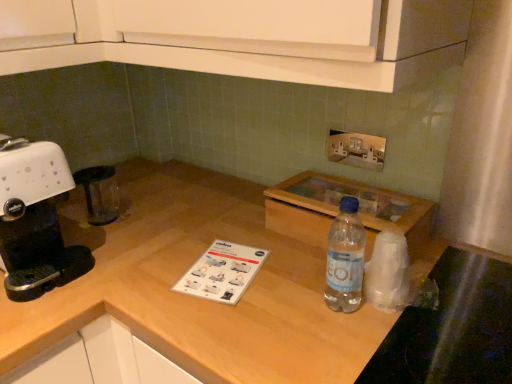
Find the location of a particular element. free region on the left part of clear plastic bottle at center is located at coordinates (257, 302).